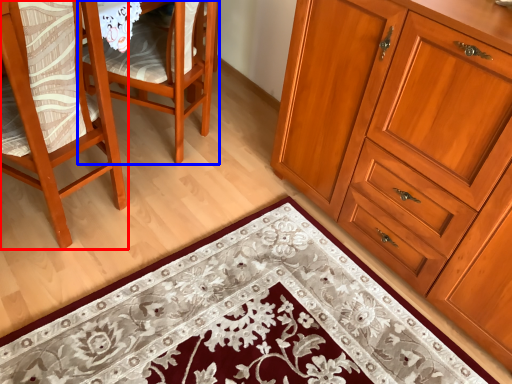
Question: Which object is closer to the camera taking this photo, chair (highlighted by a red box) or chair (highlighted by a blue box)?

Choices:
 (A) chair
 (B) chair

Answer: (A)